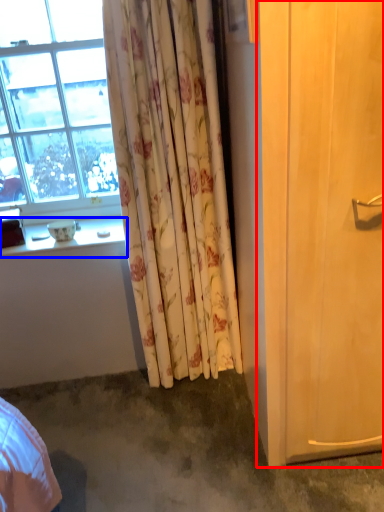
Question: Which object appears farthest to the camera in this image, screen door (highlighted by a red box) or window sill (highlighted by a blue box)?

Choices:
 (A) screen door
 (B) window sill

Answer: (B)